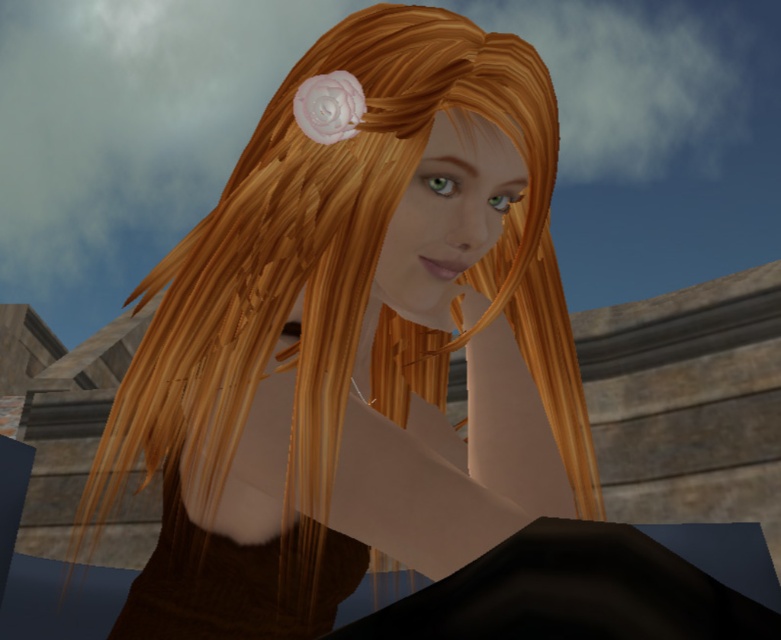
Consider the image. Who is positioned more to the left, brown textured dress at center or white matte flower at upper center?

brown textured dress at center

Is brown textured dress at center smaller than white matte flower at upper center?

No.

Where is `brown textured dress at center`? This screenshot has height=640, width=781. brown textured dress at center is located at coordinates (237, 579).

Does point (291, 120) come farther from viewer compared to point (280, 570)?

Yes, it is.

Who is positioned more to the left, shiny brown hair at center or brown textured dress at center?

Positioned to the left is brown textured dress at center.

Which is in front, point (316, 480) or point (202, 608)?

Point (316, 480) is more forward.

Where is `shiny brown hair at center`? shiny brown hair at center is located at coordinates (355, 342).

Between shiny brown hair at center and white matte flower at upper center, which one is positioned higher?

Positioned higher is white matte flower at upper center.

Can you confirm if shiny brown hair at center is positioned to the left of white matte flower at upper center?

Correct, you'll find shiny brown hair at center to the left of white matte flower at upper center.

Image resolution: width=781 pixels, height=640 pixels. What do you see at coordinates (355, 342) in the screenshot?
I see `shiny brown hair at center` at bounding box center [355, 342].

The height and width of the screenshot is (640, 781). In order to click on shiny brown hair at center in this screenshot , I will do `click(355, 342)`.